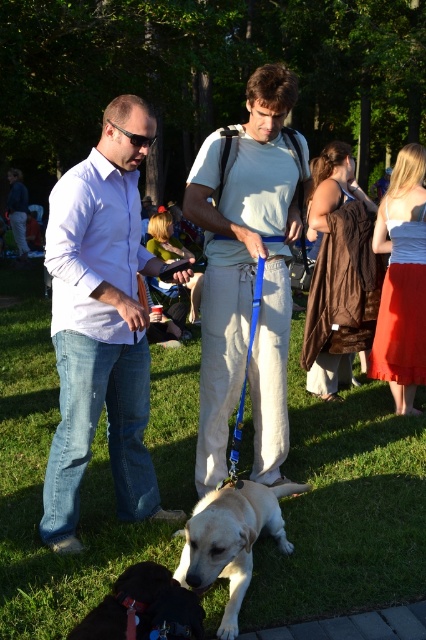
Between green grass at center and matte white shirt at center, which one is positioned lower?

green grass at center is lower down.

Is green grass at center below matte white shirt at center?

Yes.

Is point (385, 518) behind point (95, 180)?

That is True.

Where is `green grass at center`? The height and width of the screenshot is (640, 426). green grass at center is located at coordinates (344, 508).

Is light beige cotton shirt at center below brown fur dog at lower center?

No.

Who is taller, light beige cotton shirt at center or brown fur dog at lower center?

With more height is light beige cotton shirt at center.

This screenshot has height=640, width=426. What do you see at coordinates (245, 276) in the screenshot?
I see `light beige cotton shirt at center` at bounding box center [245, 276].

Where is `light beige cotton shirt at center`? Image resolution: width=426 pixels, height=640 pixels. light beige cotton shirt at center is located at coordinates 245,276.

Can you confirm if brown suede dress at center is positioned to the left of green fabric jacket at center?

In fact, brown suede dress at center is to the right of green fabric jacket at center.

Between point (371, 253) and point (166, 218), which one is positioned behind?

Point (166, 218)

Identify the location of brown suede dress at center. (339, 275).